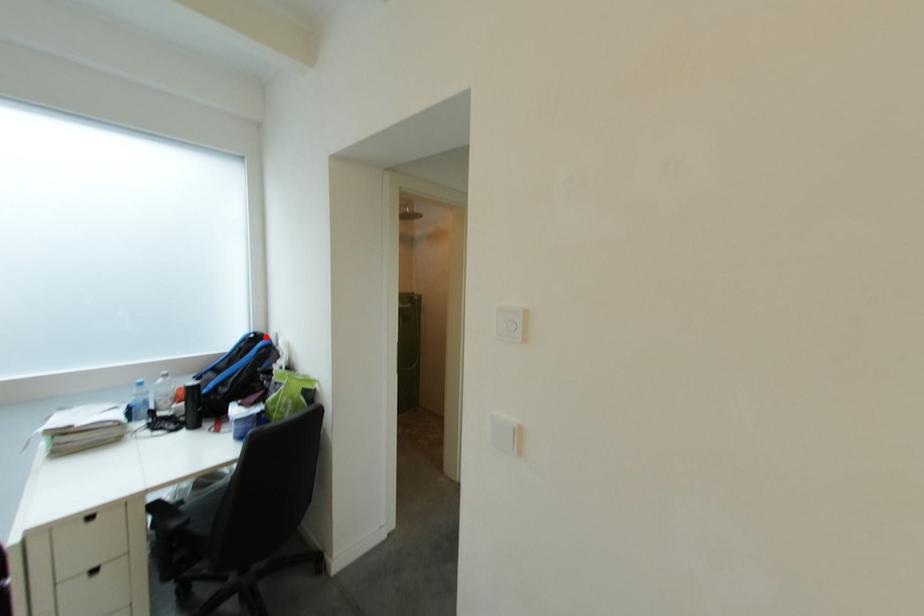
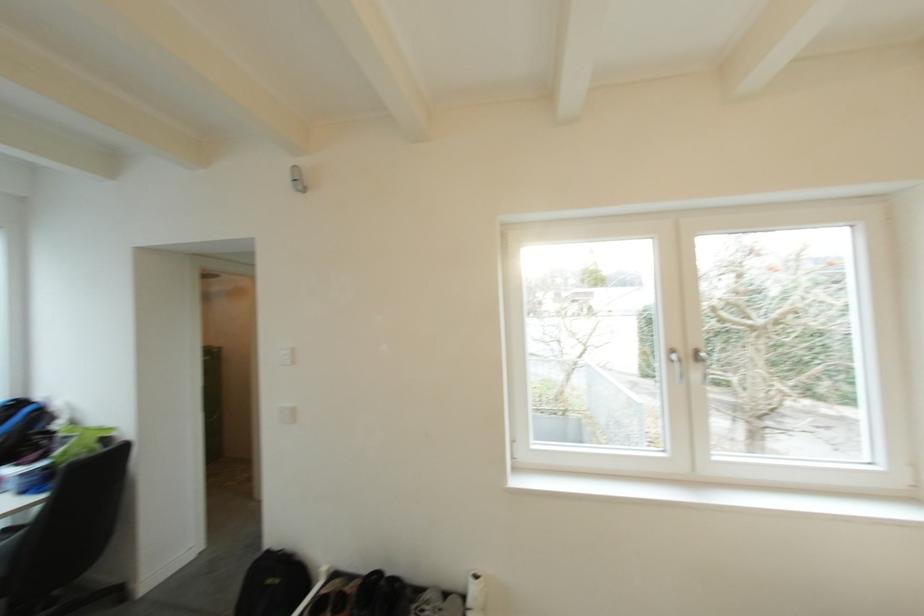
Question: A red point is marked in image1. In image2, is the corresponding 3D point closer to the camera or farther? Reply with the corresponding letter.

Choices:
 (A) The corresponding 3D point is closer.
 (B) The corresponding 3D point is farther.

Answer: (A)